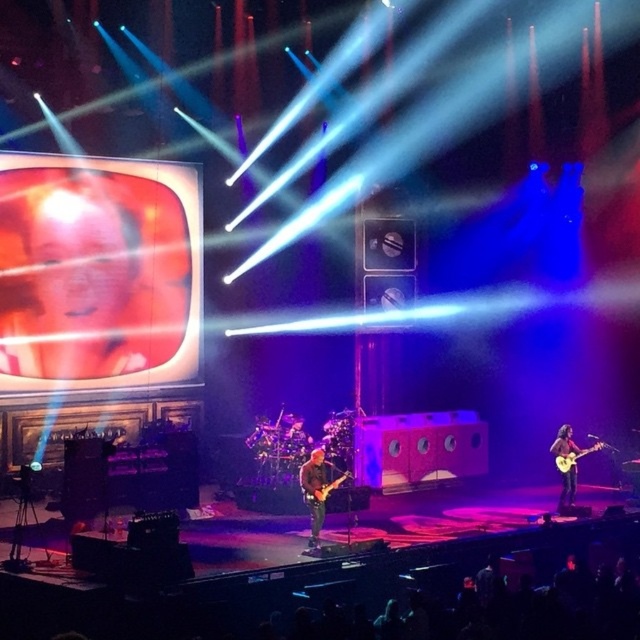
Question: Observing the image, what is the correct spatial positioning of smooth skin face at upper left in reference to shiny brown guitar at right?

Choices:
 (A) below
 (B) above

Answer: (B)

Question: Considering the relative positions of smooth skin face at upper left and light brown wooden guitar at right in the image provided, where is smooth skin face at upper left located with respect to light brown wooden guitar at right?

Choices:
 (A) left
 (B) right

Answer: (A)

Question: Which object is the farthest from the shiny black guitar at center?

Choices:
 (A) shiny brown guitar at right
 (B) light brown wooden guitar at right
 (C) smooth skin face at upper left
 (D) glossy electric guitar at center

Answer: (C)

Question: Considering the real-world distances, which object is closest to the shiny brown guitar at right?

Choices:
 (A) shiny black guitar at center
 (B) light brown wooden guitar at right
 (C) glossy electric guitar at center
 (D) smooth skin face at upper left

Answer: (B)

Question: Does smooth skin face at upper left appear on the right side of light brown wooden guitar at right?

Choices:
 (A) yes
 (B) no

Answer: (B)

Question: Estimate the real-world distances between objects in this image. Which object is farther from the glossy electric guitar at center?

Choices:
 (A) light brown wooden guitar at right
 (B) smooth skin face at upper left

Answer: (B)